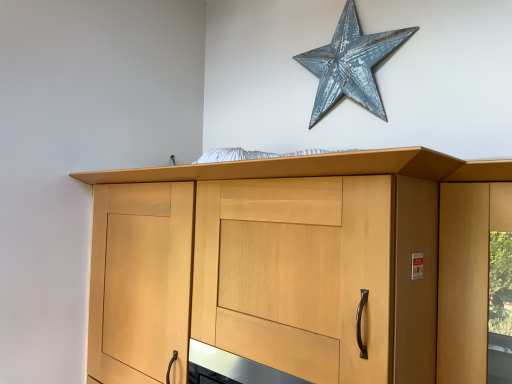
Question: Is light wood/texture cupboard at center behind rusty metal star at upper center?

Choices:
 (A) yes
 (B) no

Answer: (B)

Question: Is light wood/texture cupboard at center not near rusty metal star at upper center?

Choices:
 (A) yes
 (B) no

Answer: (B)

Question: From a real-world perspective, is light wood/texture cupboard at center over rusty metal star at upper center?

Choices:
 (A) yes
 (B) no

Answer: (B)

Question: Is light wood/texture cupboard at center outside of rusty metal star at upper center?

Choices:
 (A) yes
 (B) no

Answer: (A)

Question: Is light wood/texture cupboard at center next to rusty metal star at upper center and touching it?

Choices:
 (A) no
 (B) yes

Answer: (A)

Question: Is light wood/texture cupboard at center thinner than rusty metal star at upper center?

Choices:
 (A) yes
 (B) no

Answer: (B)

Question: Are rusty metal star at upper center and light wood/texture cupboard at center making contact?

Choices:
 (A) yes
 (B) no

Answer: (B)

Question: Is rusty metal star at upper center bigger than light wood/texture cupboard at center?

Choices:
 (A) yes
 (B) no

Answer: (B)

Question: From a real-world perspective, is rusty metal star at upper center positioned under light wood/texture cupboard at center based on gravity?

Choices:
 (A) no
 (B) yes

Answer: (A)

Question: Is rusty metal star at upper center far away from light wood/texture cupboard at center?

Choices:
 (A) yes
 (B) no

Answer: (B)

Question: Is rusty metal star at upper center not within light wood/texture cupboard at center?

Choices:
 (A) no
 (B) yes

Answer: (B)

Question: Is rusty metal star at upper center positioned with its back to light wood/texture cupboard at center?

Choices:
 (A) no
 (B) yes

Answer: (A)

Question: From a real-world perspective, is rusty metal star at upper center above or below light wood/texture cupboard at center?

Choices:
 (A) above
 (B) below

Answer: (A)